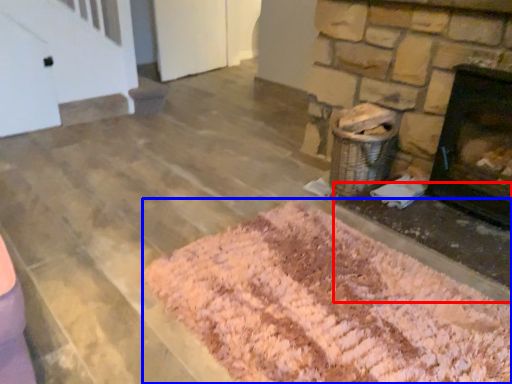
Question: Which object is closer to the camera taking this photo, foundation (highlighted by a red box) or mat (highlighted by a blue box)?

Choices:
 (A) foundation
 (B) mat

Answer: (B)